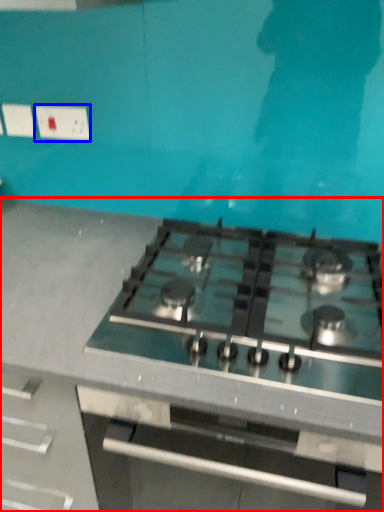
Question: Which point is closer to the camera, countertop (highlighted by a red box) or electric outlet (highlighted by a blue box)?

Choices:
 (A) countertop
 (B) electric outlet

Answer: (A)